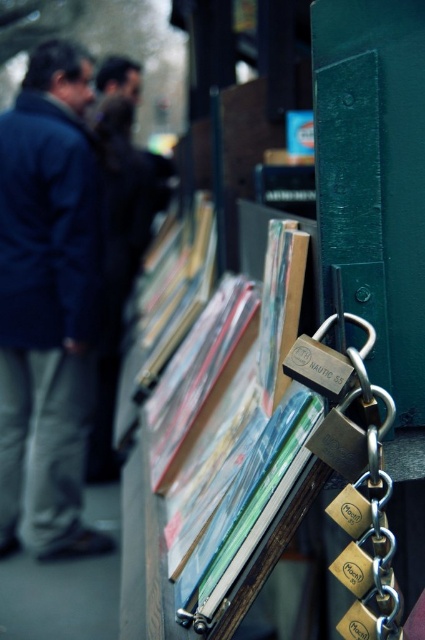
You are standing at the center of the book stall and want to reach the dark blue jacket at left. Which direction should you move to get there?

You should move to the left to reach the dark blue jacket at left since it is located at the left side of the scene.

You are a customer at the book stall and want to pick up the matte plastic books at center. There is a dark blue jacket at left in your way. Which item should you move first to reach the books?

The dark blue jacket at left is on the left side of the matte plastic books at center, so you should move the dark blue jacket at left first to reach the matte plastic books at center.